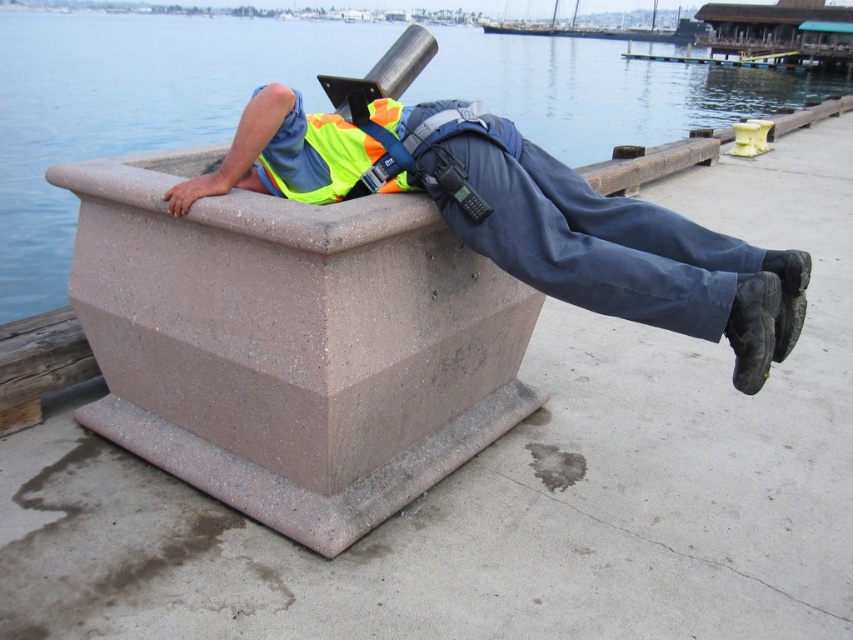
Question: From the image, what is the correct spatial relationship of high-visibility yellow vest at upper center in relation to high-visibility fabric safety vest at upper center?

Choices:
 (A) right
 (B) left

Answer: (A)

Question: Which point is farther to the camera?

Choices:
 (A) (746, 285)
 (B) (276, 170)

Answer: (B)

Question: Is high-visibility yellow vest at upper center thinner than high-visibility fabric safety vest at upper center?

Choices:
 (A) no
 (B) yes

Answer: (A)

Question: Does high-visibility yellow vest at upper center appear over high-visibility fabric safety vest at upper center?

Choices:
 (A) no
 (B) yes

Answer: (A)